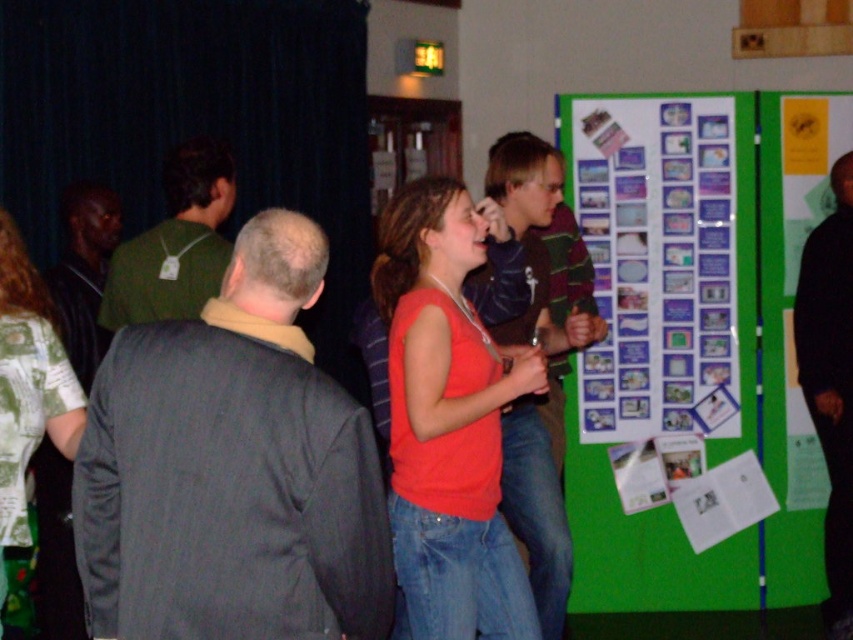
The width and height of the screenshot is (853, 640). What are the coordinates of `black fabric jacket at right` in the screenshot? It's located at (830, 380).

Who is lower down, black fabric jacket at right or printed fabric shirt at left?

black fabric jacket at right is below.

Which is in front, point (844, 289) or point (0, 438)?

Point (0, 438)

Locate an element on the screen. black fabric jacket at right is located at coordinates (830, 380).

Is purple paper at center taller than matte black jacket at left?

Yes, purple paper at center is taller than matte black jacket at left.

Which is in front, point (637, 257) or point (73, 346)?

Point (73, 346) is in front.

Between point (685, 228) and point (88, 381), which one is positioned in front?

Point (88, 381) is more forward.

At what (x,y) coordinates should I click in order to perform the action: click on purple paper at center. Please return your answer as a coordinate pair (x, y). Image resolution: width=853 pixels, height=640 pixels. Looking at the image, I should click on (659, 260).

Does striped sweater at center appear on the left side of printed fabric shirt at left?

Incorrect, striped sweater at center is not on the left side of printed fabric shirt at left.

Is point (521, 472) closer to viewer compared to point (21, 273)?

No.

Who is more distant from viewer, (544, 214) or (47, 308)?

Point (544, 214)

Where is `striped sweater at center`? striped sweater at center is located at coordinates click(547, 374).